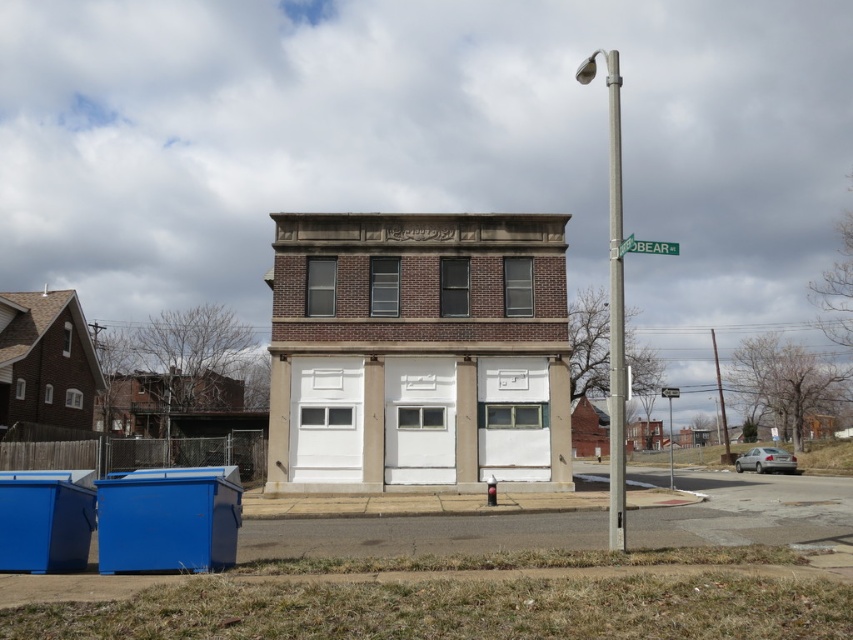
Question: Is silver metallic pole at upper right wider than green plastic street sign at upper center?

Choices:
 (A) yes
 (B) no

Answer: (A)

Question: Which object appears closest to the camera in this image?

Choices:
 (A) silver metallic pole at upper right
 (B) green plastic street sign at upper center

Answer: (A)

Question: Can you confirm if silver metallic pole at upper right is positioned to the left of green plastic street sign at upper center?

Choices:
 (A) no
 (B) yes

Answer: (A)

Question: Is silver metallic pole at upper right bigger than green plastic street sign at upper center?

Choices:
 (A) yes
 (B) no

Answer: (A)

Question: Among these objects, which one is farthest from the camera?

Choices:
 (A) green plastic street sign at upper center
 (B) silver metallic pole at upper right

Answer: (A)

Question: Which object is closer to the camera taking this photo?

Choices:
 (A) silver metallic pole at upper right
 (B) green plastic street sign at upper center

Answer: (A)